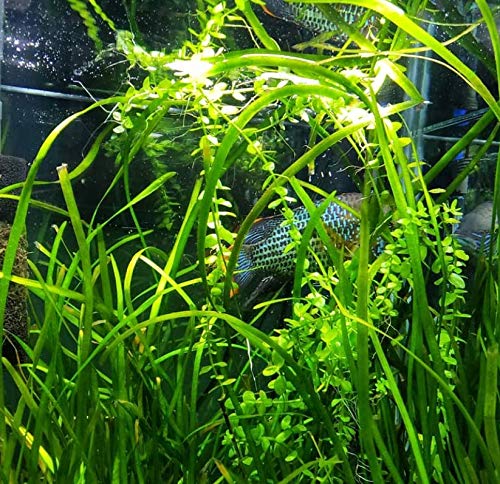
Image resolution: width=500 pixels, height=484 pixels. I want to click on light, so click(358, 114).